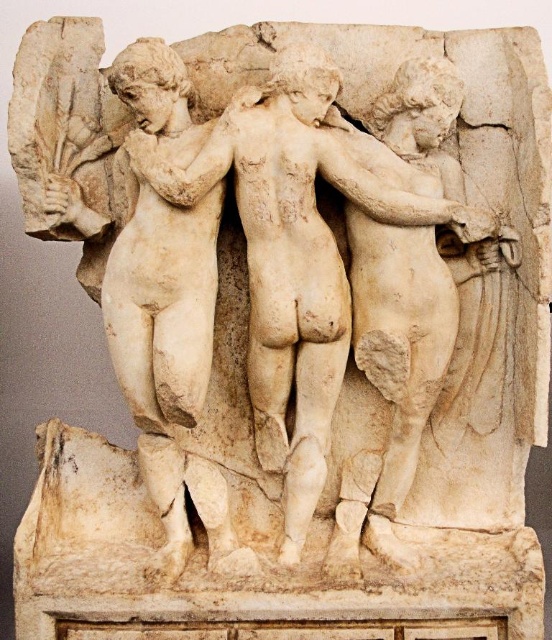
You are an art conservator examining the classical marble relief sculpture. You notice that the central male figure is part of two objects labeled as the white marble sculpture at center and the white marble statue at center. Which of these two objects has a greater width according to the description?

The white marble sculpture at center has a greater width than the white marble statue at center.

You are an art conservator examining the classical marble relief sculpture. You notice two central figures labeled as the white marble sculpture at center and the white marble statue at center. According to the description, which of these two is positioned higher?

The white marble sculpture at center is positioned higher than the white marble statue at center.